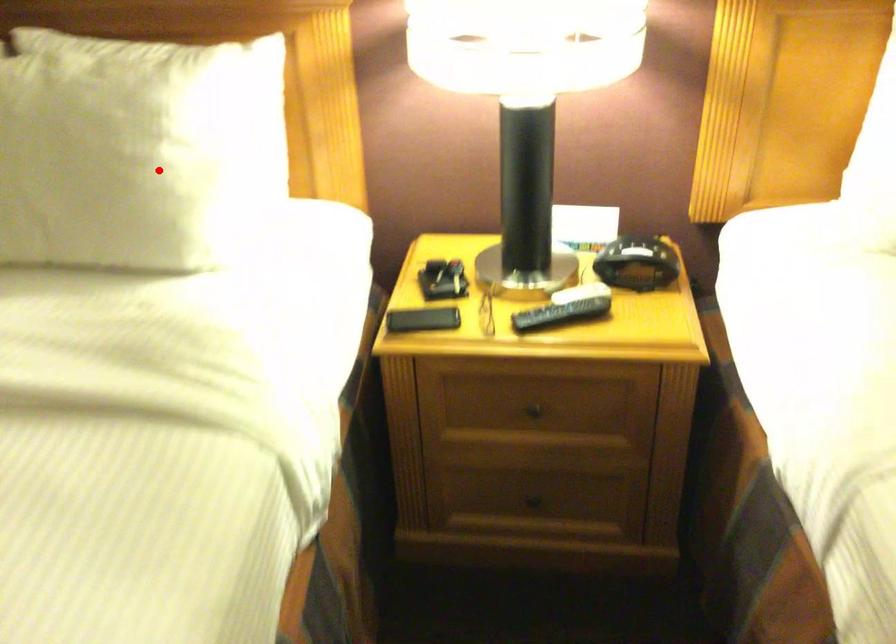
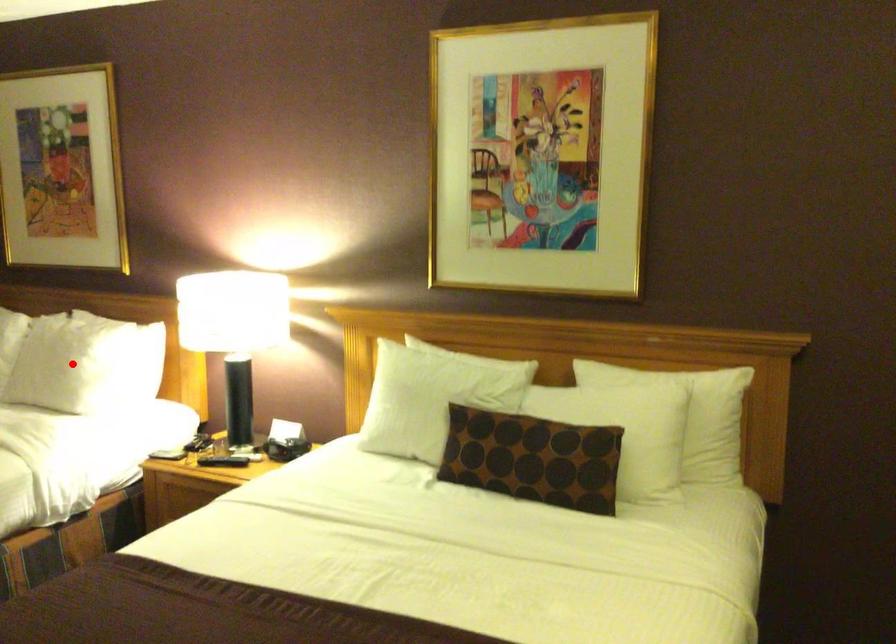
I am providing you with two images of the same scene from different viewpoints. A red point is marked on the first image and another point is marked on the second image. Does the point marked in image1 correspond to the same location as the one in image2?

Yes